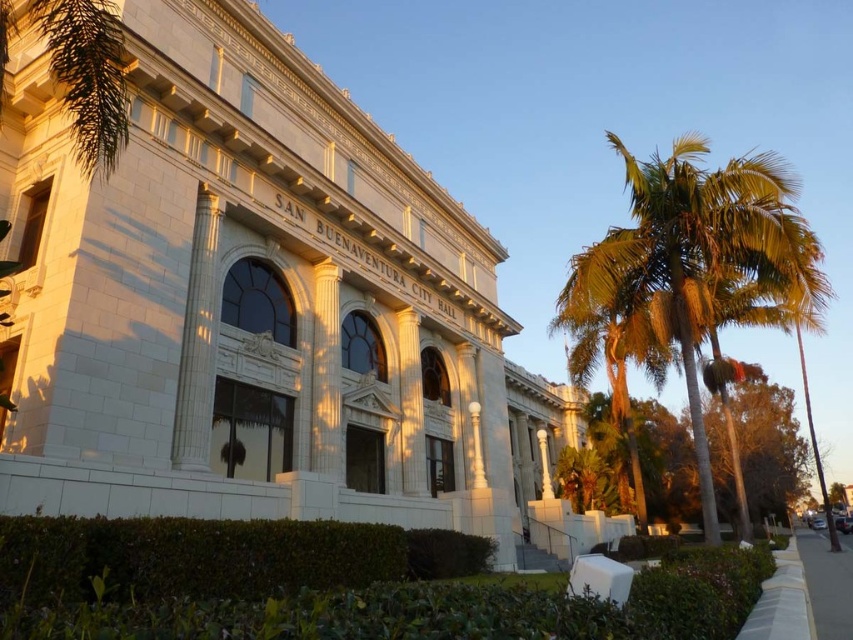
Question: Which point is closer to the camera taking this photo?

Choices:
 (A) (708, 182)
 (B) (820, 600)

Answer: (B)

Question: Is green leafy palm tree at right wider than gray concrete sidewalk at lower right?

Choices:
 (A) yes
 (B) no

Answer: (B)

Question: Among these points, which one is farthest from the camera?

Choices:
 (A) (799, 528)
 (B) (776, 314)

Answer: (A)

Question: Is green leafy palm tree at right below gray concrete sidewalk at lower right?

Choices:
 (A) no
 (B) yes

Answer: (A)

Question: Is green leafy palm tree at right positioned before gray concrete sidewalk at lower right?

Choices:
 (A) no
 (B) yes

Answer: (A)

Question: Which point is farther from the camera taking this photo?

Choices:
 (A) (828, 611)
 (B) (692, 332)

Answer: (B)